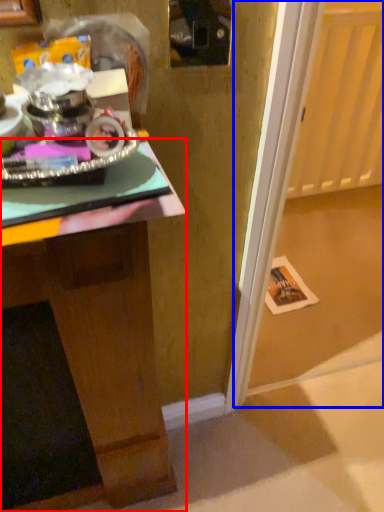
Question: Which of the following is the closest to the observer, desk (highlighted by a red box) or glass door (highlighted by a blue box)?

Choices:
 (A) desk
 (B) glass door

Answer: (A)